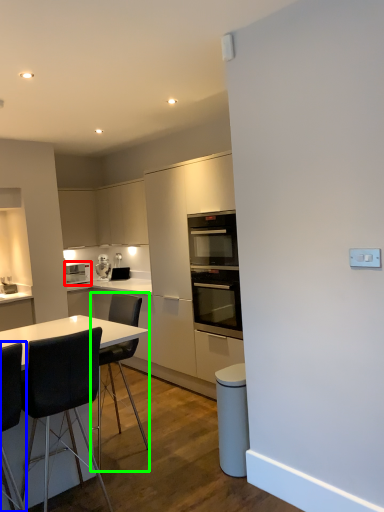
Question: Which is nearer to the home appliance (highlighted by a red box)? chair (highlighted by a blue box) or chair (highlighted by a green box).

Choices:
 (A) chair
 (B) chair

Answer: (B)